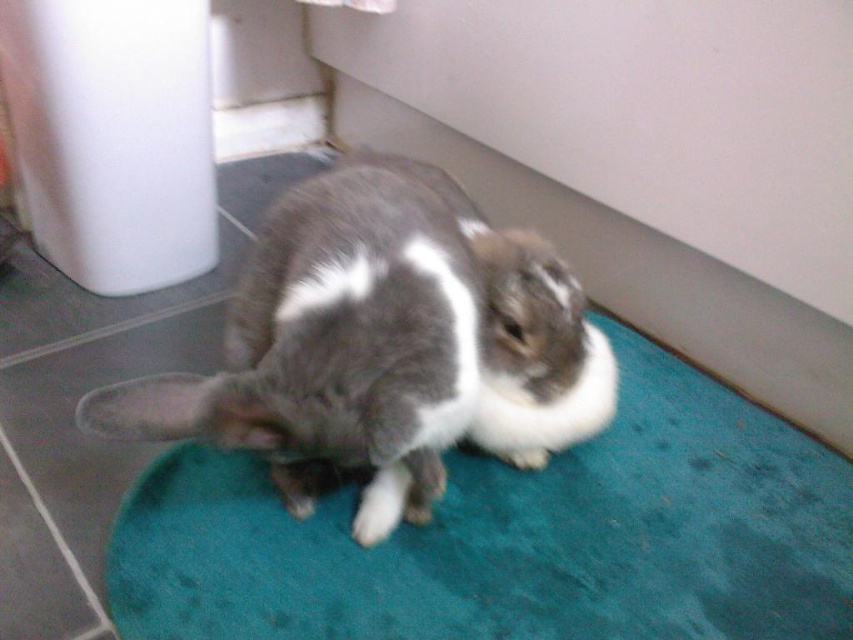
Who is positioned more to the right, teal carpet at center or gray soft fur rabbit at center?

teal carpet at center is more to the right.

Between teal carpet at center and gray soft fur rabbit at center, which one is positioned lower?

teal carpet at center

Between point (264, 620) and point (219, 380), which one is positioned behind?

Positioned behind is point (264, 620).

I want to click on teal carpet at center, so click(514, 536).

Can you confirm if gray soft fur rabbit at center is taller than gray and white fur rabbit at center?

Yes, gray soft fur rabbit at center is taller than gray and white fur rabbit at center.

Does point (264, 445) lie behind point (485, 413)?

No.

I want to click on gray soft fur rabbit at center, so click(x=334, y=348).

Which is above, teal carpet at center or gray and white fur rabbit at center?

Positioned higher is gray and white fur rabbit at center.

Can you confirm if teal carpet at center is positioned to the right of gray and white fur rabbit at center?

No, teal carpet at center is not to the right of gray and white fur rabbit at center.

Is point (747, 458) less distant than point (543, 352)?

No.

This screenshot has height=640, width=853. In order to click on teal carpet at center in this screenshot , I will do `click(514, 536)`.